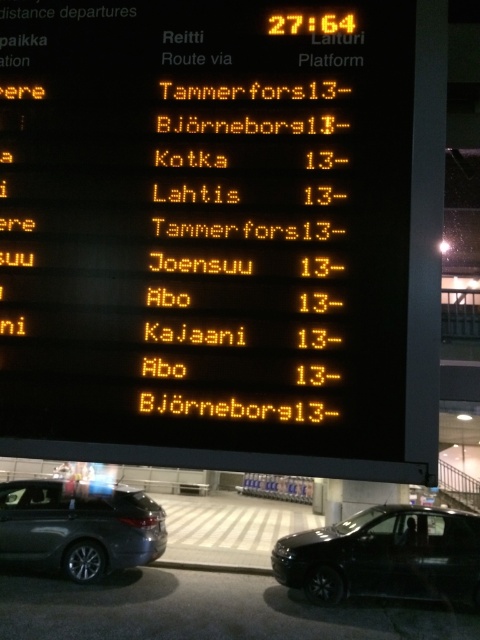
You are waiting at the train station and see the yellow led display at center and the black glossy car at lower right. Which object is wider?

The black glossy car at lower right is wider than the yellow led display at center.

You are a passenger at the train station and see the yellow led display at center and the black glossy car at lower right. Which object is located higher in the image?

The yellow led display at center is above the black glossy car at lower right, so it is located higher in the image.